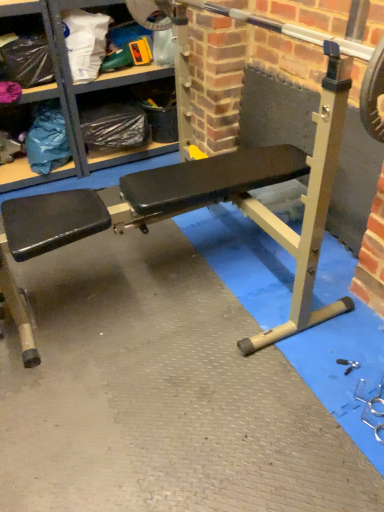
Question: In terms of width, does matte plastic shelf at upper left look wider or thinner when compared to metallic silver barbell at center?

Choices:
 (A) thin
 (B) wide

Answer: (B)

Question: In the image, is matte plastic shelf at upper left positioned in front of or behind metallic silver barbell at center?

Choices:
 (A) front
 (B) behind

Answer: (B)

Question: From a real-world perspective, is matte plastic shelf at upper left positioned above or below metallic silver barbell at center?

Choices:
 (A) above
 (B) below

Answer: (B)

Question: Is metallic silver barbell at center spatially inside matte plastic shelf at upper left, or outside of it?

Choices:
 (A) inside
 (B) outside

Answer: (B)

Question: Is metallic silver barbell at center taller or shorter than matte plastic shelf at upper left?

Choices:
 (A) tall
 (B) short

Answer: (B)

Question: In the image, is metallic silver barbell at center on the left side or the right side of matte plastic shelf at upper left?

Choices:
 (A) right
 (B) left

Answer: (A)

Question: In terms of width, does metallic silver barbell at center look wider or thinner when compared to matte plastic shelf at upper left?

Choices:
 (A) thin
 (B) wide

Answer: (A)